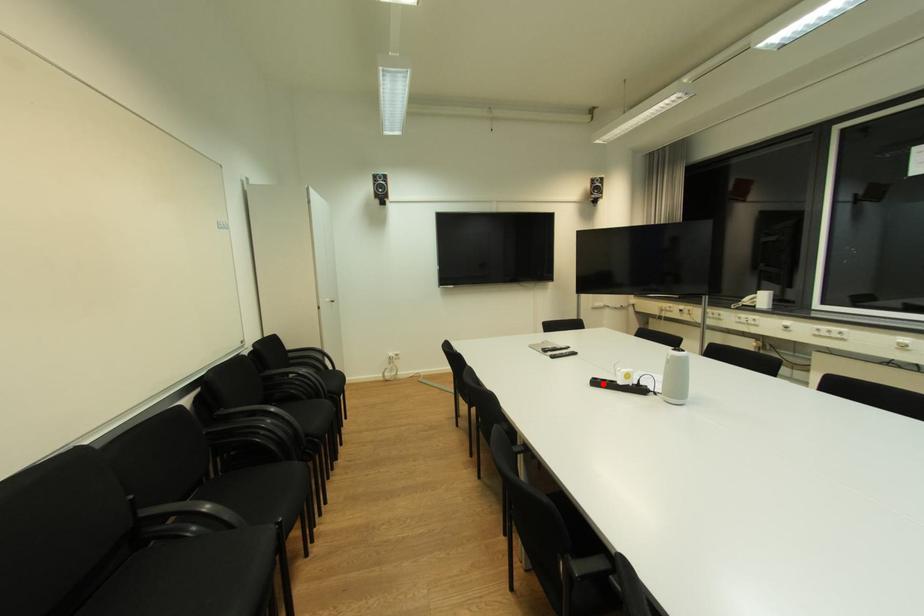
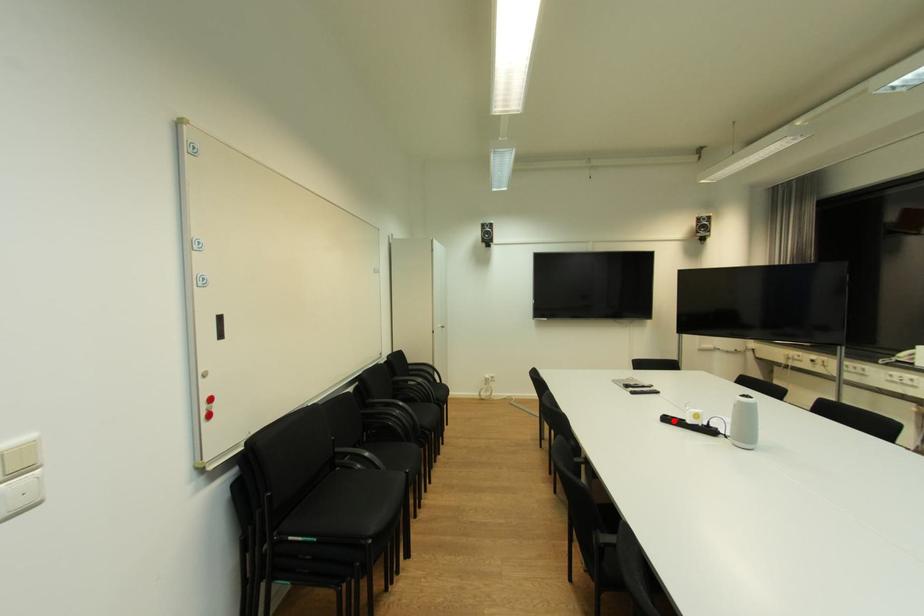
I am providing you with two images of the same scene from different viewpoints. A red point is marked on the first image and another point is marked on the second image. Does the point marked in image1 correspond to the same location as the one in image2?

Yes